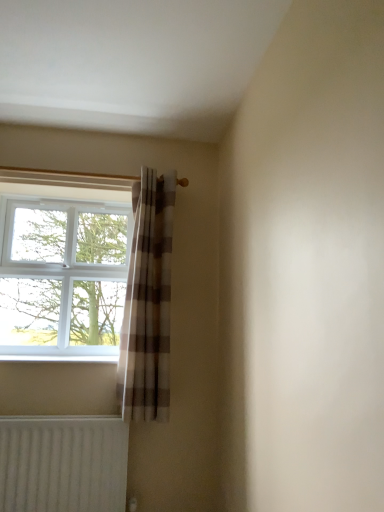
Question: Looking at their shapes, would you say white ribbed radiator at lower left is wider or thinner than plaid fabric curtain at center?

Choices:
 (A) wide
 (B) thin

Answer: (B)

Question: From the image's perspective, is white ribbed radiator at lower left located above or below plaid fabric curtain at center?

Choices:
 (A) below
 (B) above

Answer: (A)

Question: Which object is the farthest from the white plastic window at left?

Choices:
 (A) plaid fabric curtain at center
 (B) white ribbed radiator at lower left

Answer: (B)

Question: Estimate the real-world distances between objects in this image. Which object is closer to the white plastic window at left?

Choices:
 (A) white ribbed radiator at lower left
 (B) plaid fabric curtain at center

Answer: (B)